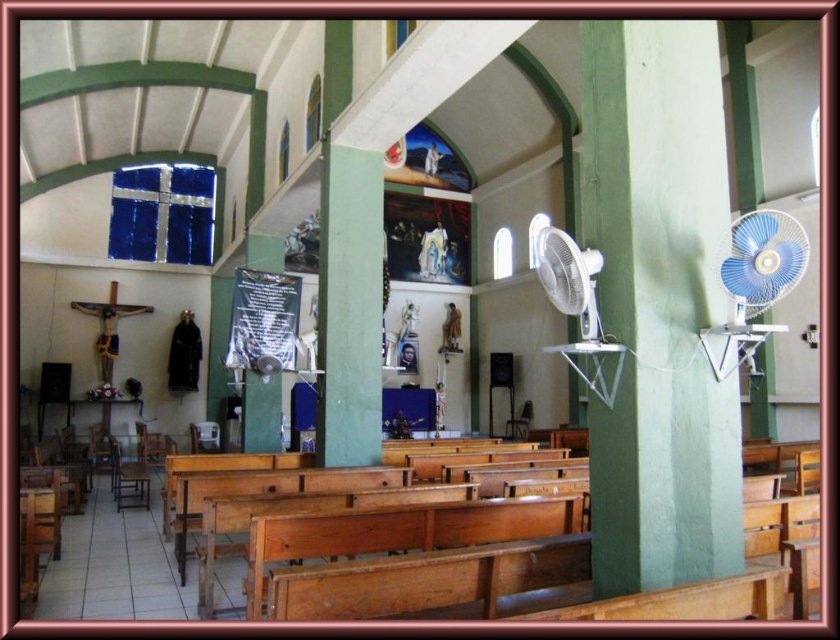
Question: Which object appears farthest from the camera in this image?

Choices:
 (A) green smooth pillar at center
 (B) wooden at center

Answer: (B)

Question: Which point is farther from the camera taking this photo?

Choices:
 (A) pyautogui.click(x=510, y=424)
 (B) pyautogui.click(x=783, y=248)
 (C) pyautogui.click(x=323, y=179)
 (D) pyautogui.click(x=634, y=26)

Answer: (A)

Question: Which point is farther to the camera?

Choices:
 (A) white plastic fan at upper right
 (B) brown wooden chair at lower left

Answer: (B)

Question: Does white plastic fan at upper right appear on the right side of wooden at center?

Choices:
 (A) yes
 (B) no

Answer: (B)

Question: Can you confirm if wooden bench at center is positioned below white plastic fan at upper right?

Choices:
 (A) no
 (B) yes

Answer: (B)

Question: Can you confirm if wooden bench at center is smaller than blue plastic fan at right?

Choices:
 (A) no
 (B) yes

Answer: (A)